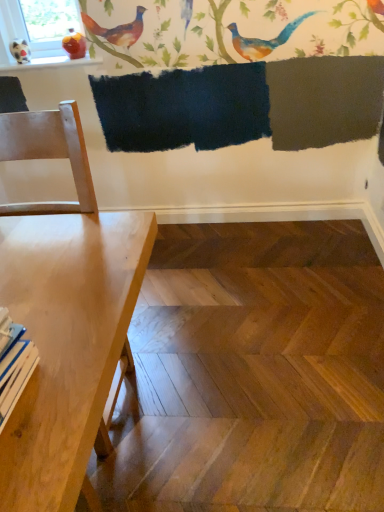
The height and width of the screenshot is (512, 384). What do you see at coordinates (20, 51) in the screenshot?
I see `white glossy bird at upper left` at bounding box center [20, 51].

What is the approximate width of white glossy bird at upper left?

white glossy bird at upper left is 11.30 centimeters wide.

Where is `white glossy bird at upper left`? The width and height of the screenshot is (384, 512). white glossy bird at upper left is located at coordinates (20, 51).

Measure the distance between point [80,292] and camera.

Point [80,292] and camera are 1.04 meters apart from each other.

Based on the photo, measure the distance between light wood table at left and camera.

light wood table at left is 24.55 inches away from camera.

Locate an element on the screen. The width and height of the screenshot is (384, 512). light wood table at left is located at coordinates (66, 342).

What do you see at coordinates (66, 342) in the screenshot? This screenshot has width=384, height=512. I see `light wood table at left` at bounding box center [66, 342].

This screenshot has height=512, width=384. What are the coordinates of `white glossy bird at upper left` in the screenshot? It's located at (20, 51).

Looking at this image, which object is positioned more to the left, white glossy bird at upper left or light wood table at left?

white glossy bird at upper left.

Based on the photo, which object is further away from the camera taking this photo, white glossy bird at upper left or light wood table at left?

Positioned behind is white glossy bird at upper left.

Is point (12, 42) closer to viewer compared to point (143, 232)?

No, it is not.

From the image's perspective, which one is positioned lower, white glossy bird at upper left or light wood table at left?

light wood table at left, from the image's perspective.

From a real-world perspective, which object rests below the other?

light wood table at left, from a real-world perspective.

Considering the relative sizes of white glossy bird at upper left and light wood table at left in the image provided, is white glossy bird at upper left wider than light wood table at left?

Incorrect, the width of white glossy bird at upper left does not surpass that of light wood table at left.

Which of these two, white glossy bird at upper left or light wood table at left, stands shorter?

With less height is white glossy bird at upper left.

Who is smaller, white glossy bird at upper left or light wood table at left?

white glossy bird at upper left is smaller.

Can we say white glossy bird at upper left lies outside light wood table at left?

Yes, white glossy bird at upper left is not within light wood table at left.

Is white glossy bird at upper left positioned far away from light wood table at left?

Absolutely, white glossy bird at upper left is distant from light wood table at left.

Is white glossy bird at upper left oriented towards light wood table at left?

Yes, white glossy bird at upper left is turned towards light wood table at left.

Identify the location of table in front of the white glossy bird at upper left. (66, 342).

Between light wood table at left and white glossy bird at upper left, which one appears on the right side from the viewer's perspective?

From the viewer's perspective, light wood table at left appears more on the right side.

In the image, is light wood table at left positioned in front of or behind white glossy bird at upper left?

light wood table at left is in front of white glossy bird at upper left.

Which is less distant, (28, 296) or (24, 58)?

Clearly, point (28, 296) is closer to the camera than point (24, 58).

From the image's perspective, which is above, light wood table at left or white glossy bird at upper left?

white glossy bird at upper left.

Consider the image. From a real-world perspective, who is located higher, light wood table at left or white glossy bird at upper left?

white glossy bird at upper left is physically above.

Looking at this image, looking at their sizes, would you say light wood table at left is wider or thinner than white glossy bird at upper left?

Clearly, light wood table at left has more width compared to white glossy bird at upper left.

Considering the sizes of objects light wood table at left and white glossy bird at upper left in the image provided, who is taller, light wood table at left or white glossy bird at upper left?

With more height is light wood table at left.

Does light wood table at left have a smaller size compared to white glossy bird at upper left?

No, light wood table at left is not smaller than white glossy bird at upper left.

Does light wood table at left contain white glossy bird at upper left?

No.

Are light wood table at left and white glossy bird at upper left located far from each other?

Yes, light wood table at left is far from white glossy bird at upper left.

Is light wood table at left facing away from white glossy bird at upper left?

light wood table at left does not have its back to white glossy bird at upper left.

Locate an element on the screen. The width and height of the screenshot is (384, 512). bird behind the light wood table at left is located at coordinates (20, 51).

Find the location of `table that is below the white glossy bird at upper left (from the image's perspective)`. table that is below the white glossy bird at upper left (from the image's perspective) is located at coordinates (66, 342).

Locate an element on the screen. This screenshot has width=384, height=512. table in front of the white glossy bird at upper left is located at coordinates (66, 342).